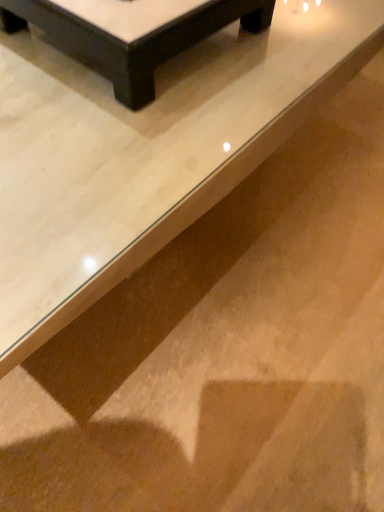
What are the coordinates of `free location to the right of black glossy table at upper center, the second table when ordered from front to back` in the screenshot? It's located at (293, 47).